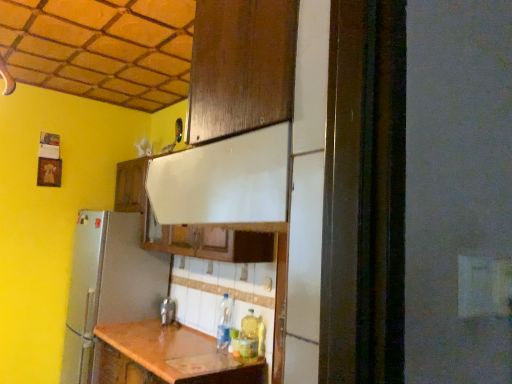
Question: From a real-world perspective, does translucent plastic bottle at lower center, the second bottle when ordered from left to right, stand above metallic silver faucet at center?

Choices:
 (A) yes
 (B) no

Answer: (A)

Question: Is translucent plastic bottle at lower center, the second bottle when ordered from left to right, closer to camera compared to metallic silver faucet at center?

Choices:
 (A) no
 (B) yes

Answer: (B)

Question: Is translucent plastic bottle at lower center, the second bottle when ordered from left to right, positioned beyond the bounds of metallic silver faucet at center?

Choices:
 (A) yes
 (B) no

Answer: (A)

Question: Can you confirm if translucent plastic bottle at lower center, the second bottle when ordered from left to right, is shorter than metallic silver faucet at center?

Choices:
 (A) yes
 (B) no

Answer: (B)

Question: Is translucent plastic bottle at lower center, the second bottle when ordered from left to right, aimed at metallic silver faucet at center?

Choices:
 (A) yes
 (B) no

Answer: (B)

Question: Would you say translucent plastic bottle at lower center, which is the first bottle in front-to-back order, contains metallic silver faucet at center?

Choices:
 (A) no
 (B) yes

Answer: (A)

Question: Is metallic silver faucet at center in front of clear plastic bottle at center, the first bottle from the left?

Choices:
 (A) no
 (B) yes

Answer: (A)

Question: Is metallic silver faucet at center positioned with its back to clear plastic bottle at center, the first bottle from the left?

Choices:
 (A) no
 (B) yes

Answer: (A)

Question: From the image's perspective, is metallic silver faucet at center below clear plastic bottle at center, the first bottle from the left?

Choices:
 (A) no
 (B) yes

Answer: (B)

Question: From a real-world perspective, is metallic silver faucet at center physically above clear plastic bottle at center, the 1th bottle in the back-to-front sequence?

Choices:
 (A) yes
 (B) no

Answer: (B)

Question: Are metallic silver faucet at center and clear plastic bottle at center, which is counted as the 2th bottle, starting from the right, located far from each other?

Choices:
 (A) yes
 (B) no

Answer: (B)

Question: Is clear plastic bottle at center, the 1th bottle in the back-to-front sequence, completely or partially inside metallic silver faucet at center?

Choices:
 (A) yes
 (B) no

Answer: (B)

Question: Is translucent plastic bottle at lower center, positioned as the 1th bottle in right-to-left order, at the right side of clear plastic bottle at center, the 2th bottle in the front-to-back sequence?

Choices:
 (A) no
 (B) yes

Answer: (B)